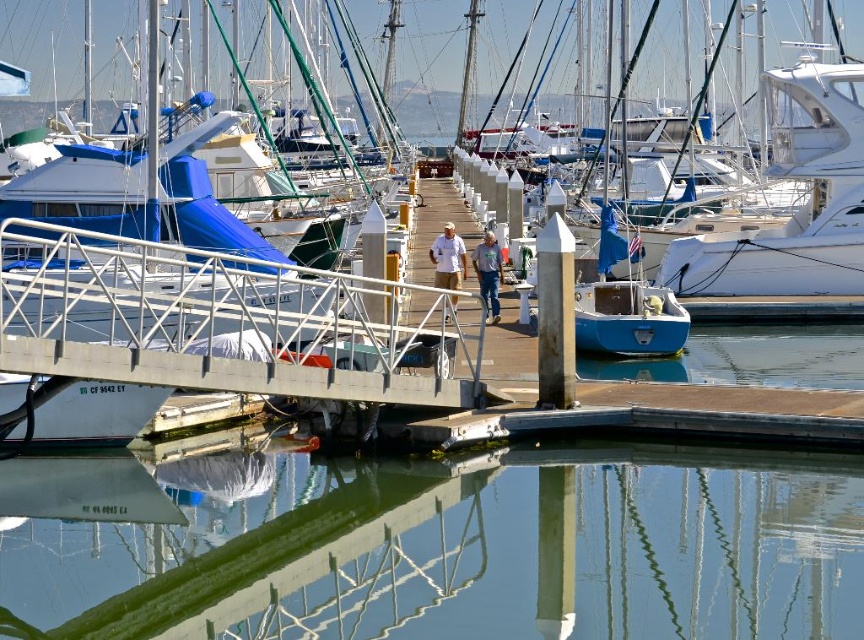
Looking at this image, you are standing on the curved dock and see the clear glass water at center and the blue jeans at center. Which object is closer to the ground?

The clear glass water at center is located below blue jeans at center, so it is closer to the ground.